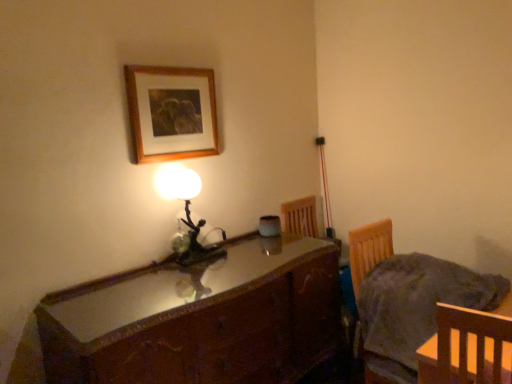
Question: Is wooden picture frame at upper center oriented towards matte glass lamp at center?

Choices:
 (A) no
 (B) yes

Answer: (A)

Question: Is wooden picture frame at upper center oriented away from matte glass lamp at center?

Choices:
 (A) yes
 (B) no

Answer: (B)

Question: Considering the relative sizes of wooden picture frame at upper center and matte glass lamp at center in the image provided, is wooden picture frame at upper center thinner than matte glass lamp at center?

Choices:
 (A) yes
 (B) no

Answer: (A)

Question: Considering the relative positions of wooden picture frame at upper center and matte glass lamp at center in the image provided, is wooden picture frame at upper center to the left of matte glass lamp at center from the viewer's perspective?

Choices:
 (A) no
 (B) yes

Answer: (B)

Question: Is the depth of wooden picture frame at upper center less than that of matte glass lamp at center?

Choices:
 (A) yes
 (B) no

Answer: (A)

Question: Can you confirm if wooden picture frame at upper center is smaller than matte glass lamp at center?

Choices:
 (A) no
 (B) yes

Answer: (B)

Question: Is shiny brown wooden desk at center shorter than wooden chair at lower right?

Choices:
 (A) yes
 (B) no

Answer: (B)

Question: Could you tell me if shiny brown wooden desk at center is facing wooden chair at lower right?

Choices:
 (A) no
 (B) yes

Answer: (B)

Question: Is shiny brown wooden desk at center thinner than wooden chair at lower right?

Choices:
 (A) no
 (B) yes

Answer: (A)

Question: Can we say shiny brown wooden desk at center lies outside wooden chair at lower right?

Choices:
 (A) yes
 (B) no

Answer: (A)

Question: From the image's perspective, is shiny brown wooden desk at center above wooden chair at lower right?

Choices:
 (A) yes
 (B) no

Answer: (B)

Question: Considering the relative sizes of shiny brown wooden desk at center and wooden chair at lower right in the image provided, is shiny brown wooden desk at center bigger than wooden chair at lower right?

Choices:
 (A) yes
 (B) no

Answer: (A)

Question: From a real-world perspective, does matte glass lamp at center sit lower than wooden picture frame at upper center?

Choices:
 (A) no
 (B) yes

Answer: (B)